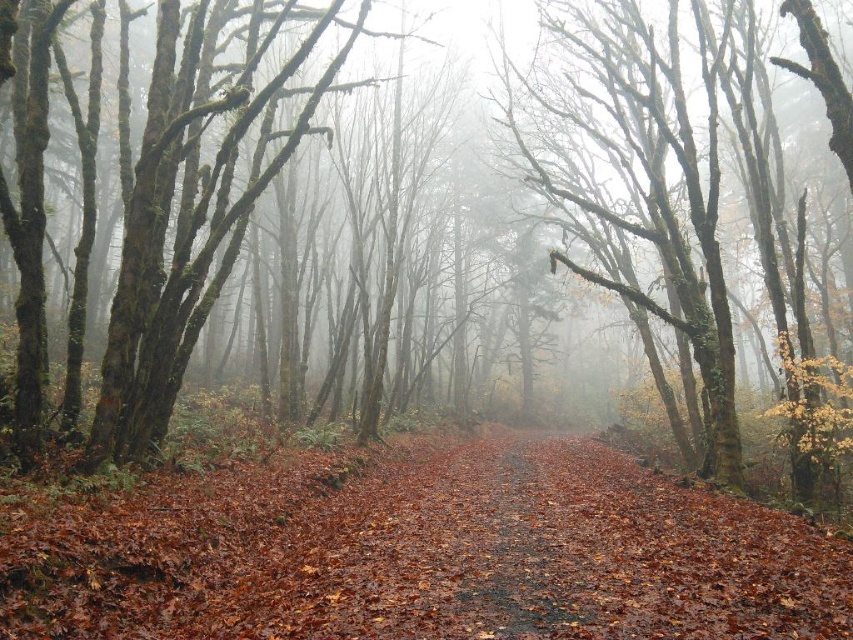
Does smooth bark tree at center appear under brown leafy forest path at center?

Incorrect, smooth bark tree at center is not positioned below brown leafy forest path at center.

Does smooth bark tree at center have a larger size compared to brown leafy forest path at center?

Indeed, smooth bark tree at center has a larger size compared to brown leafy forest path at center.

You are a GUI agent. You are given a task and a screenshot of the screen. Output one action in this format:
    pyautogui.click(x=<x>, y=<y>)
    Task: Click on the smooth bark tree at center
    
    Given the screenshot: What is the action you would take?
    pyautogui.click(x=660, y=179)